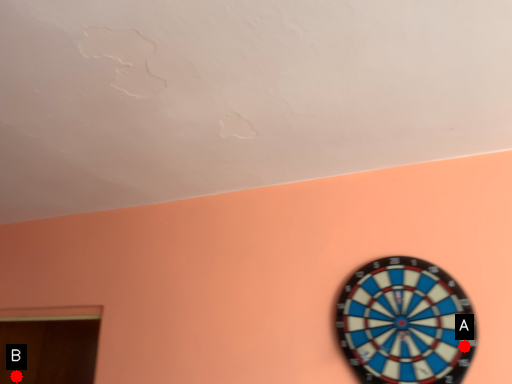
Question: Two points are circled on the image, labeled by A and B beside each circle. Which of the following is the farthest from the observer?

Choices:
 (A) A is further
 (B) B is further

Answer: (B)